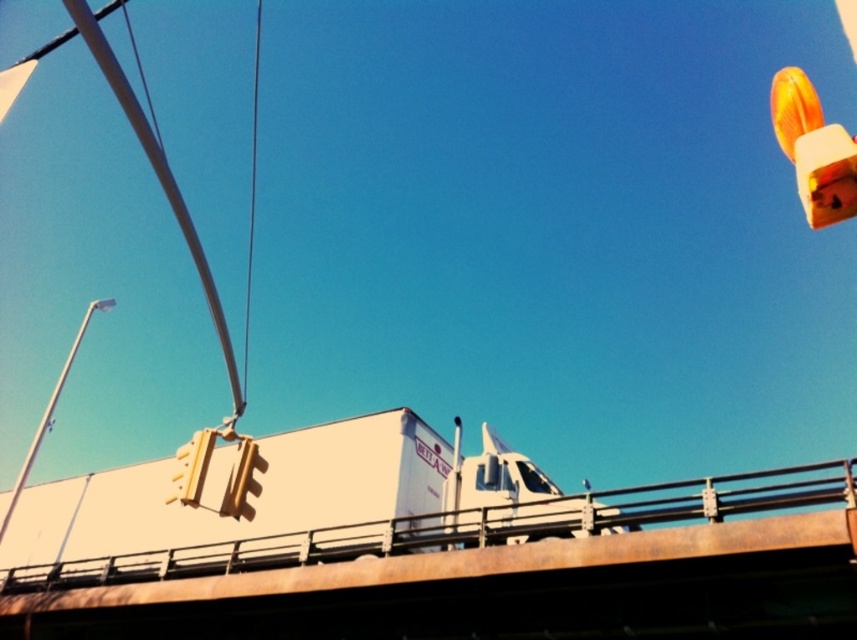
Question: Can you confirm if white matte trailer truck at center is positioned to the left of orange glossy traffic light at upper right?

Choices:
 (A) yes
 (B) no

Answer: (A)

Question: Is white matte truck at center above white metal pole at left?

Choices:
 (A) no
 (B) yes

Answer: (A)

Question: Among these objects, which one is nearest to the camera?

Choices:
 (A) white matte truck at center
 (B) yellow matte traffic light at left

Answer: (B)

Question: Is white matte truck at center to the right of white metal pole at left from the viewer's perspective?

Choices:
 (A) no
 (B) yes

Answer: (B)

Question: Which point is closer to the camera?

Choices:
 (A) (15, 492)
 (B) (580, 577)
 (C) (814, 147)

Answer: (C)

Question: Among these objects, which one is nearest to the camera?

Choices:
 (A) orange glossy traffic light at upper right
 (B) yellow matte traffic light at left

Answer: (A)